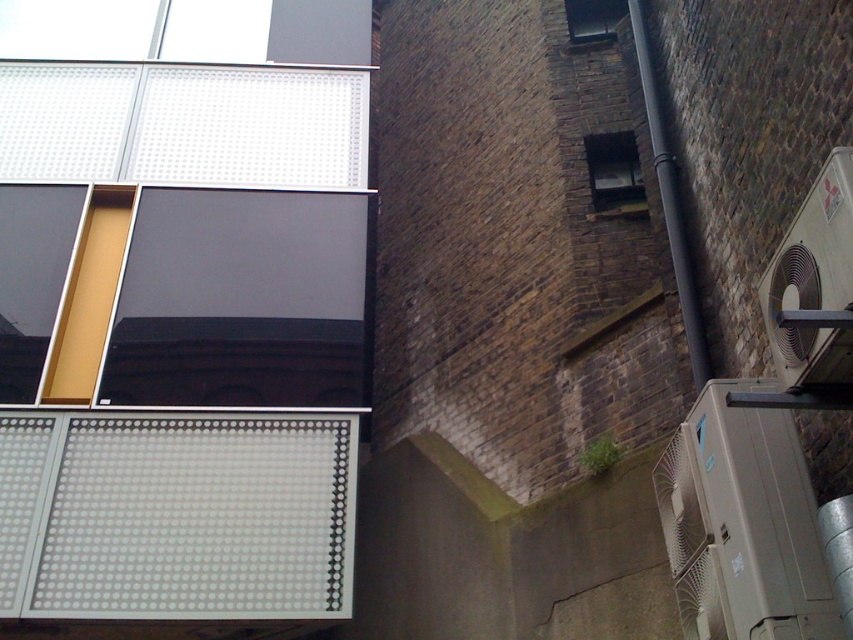
Which is behind, point (592, 160) or point (619, 16)?

The point (619, 16) is more distant.

This screenshot has height=640, width=853. What are the coordinates of `clear glass window at upper right` in the screenshot? It's located at (613, 170).

This screenshot has width=853, height=640. I want to click on clear glass window at upper right, so click(x=613, y=170).